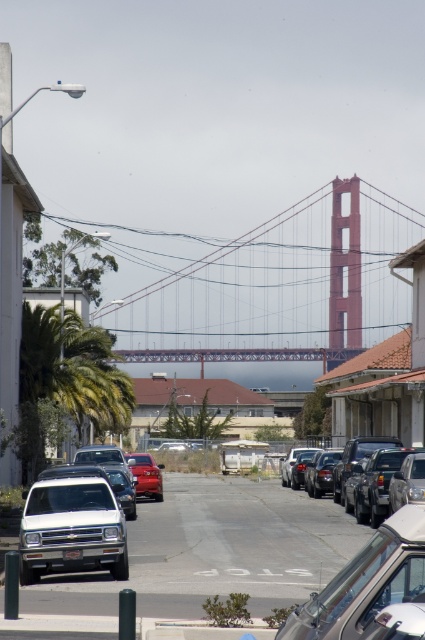
Question: Based on their relative distances, which object is nearer to the clear glass car at center?

Choices:
 (A) shiny red sedan at center
 (B) red painted steel golden gate bridge at center

Answer: (A)

Question: Is clear glass car at center in front of shiny red sedan at center?

Choices:
 (A) no
 (B) yes

Answer: (B)

Question: Is clear glass car at center further to camera compared to shiny red sedan at center?

Choices:
 (A) no
 (B) yes

Answer: (A)

Question: Is clear glass car at center positioned before shiny red sedan at center?

Choices:
 (A) yes
 (B) no

Answer: (A)

Question: Estimate the real-world distances between objects in this image. Which object is farther from the shiny red sedan at center?

Choices:
 (A) red painted steel golden gate bridge at center
 (B) clear glass car at center

Answer: (A)

Question: Which object is positioned farthest from the shiny red sedan at center?

Choices:
 (A) red painted steel golden gate bridge at center
 (B) clear glass car at center
 (C) white matte truck at center

Answer: (A)